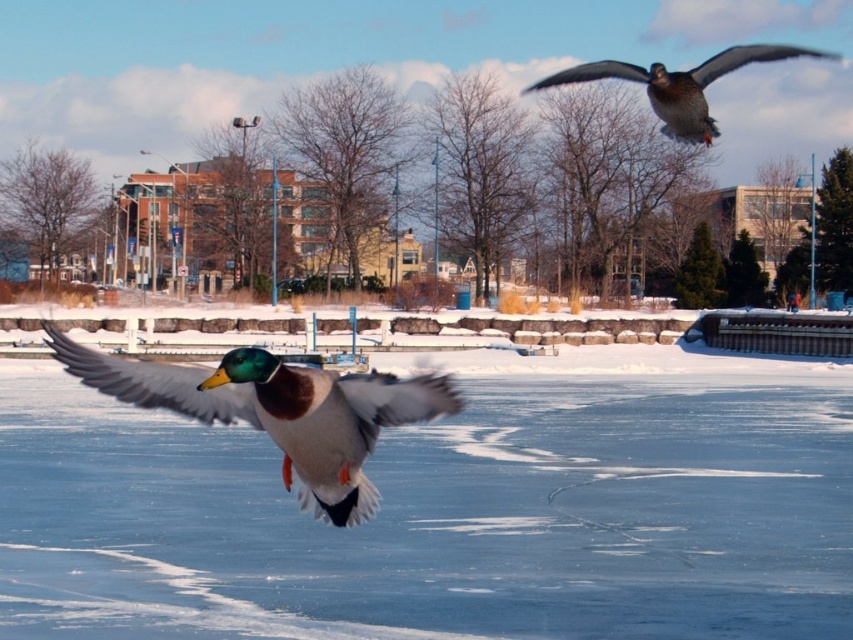
Does translucent ice at center lie in front of shiny brown duck at center?

No, it is not.

Is translucent ice at center smaller than shiny brown duck at center?

Actually, translucent ice at center might be larger than shiny brown duck at center.

Locate an element on the screen. translucent ice at center is located at coordinates (442, 516).

Does point (357, 465) come closer to viewer compared to point (671, 76)?

Yes, point (357, 465) is in front of point (671, 76).

Who is higher up, shiny brown duck at center or shiny brown duck at upper right?

Positioned higher is shiny brown duck at upper right.

In order to click on shiny brown duck at center in this screenshot , I will do `click(279, 412)`.

I want to click on shiny brown duck at center, so click(x=279, y=412).

Is translucent ice at center to the right of shiny brown duck at upper right from the viewer's perspective?

No, translucent ice at center is not to the right of shiny brown duck at upper right.

Is translucent ice at center wider than shiny brown duck at upper right?

No, translucent ice at center is not wider than shiny brown duck at upper right.

Where is `translucent ice at center`? translucent ice at center is located at coordinates (442, 516).

At what (x,y) coordinates should I click in order to perform the action: click on translucent ice at center. Please return your answer as a coordinate pair (x, y). Looking at the image, I should click on (442, 516).